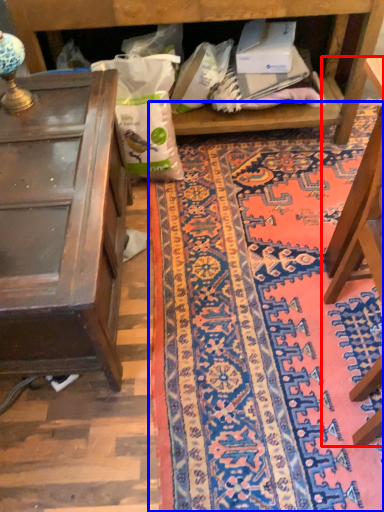
Question: Which of the following is the closest to the observer, furniture (highlighted by a red box) or mat (highlighted by a blue box)?

Choices:
 (A) furniture
 (B) mat

Answer: (A)